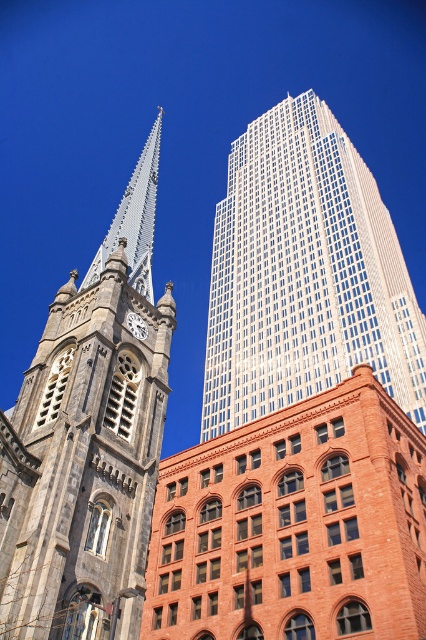
You are standing in the middle of the square and want to take a photo of the gray stone tower at left. According to the coordinates provided, in which direction should you point your camera to capture it?

You should point your camera to the left since the gray stone tower at left is located at coordinates point (89,440), which places it on the left side of the scene.

You are an architect analyzing the skyline of this city. You notice the gray stone tower at left and the white glass skyscraper at upper center. Which structure occupies a larger area in the image?

The gray stone tower at left is bigger than the white glass skyscraper at upper center, so it occupies a larger area in the image.

You are standing in a park and want to take a photo of the gray stone tower at left. The park has a path that allows you to walk up to 30 meters away from the tower. Can you get close enough to take a clear photo without needing a zoom lens?

The distance between you and the gray stone tower at left is 27.41 meters, which is within the 30 meters limit. Therefore, you can get close enough to take a clear photo without needing a zoom lens.